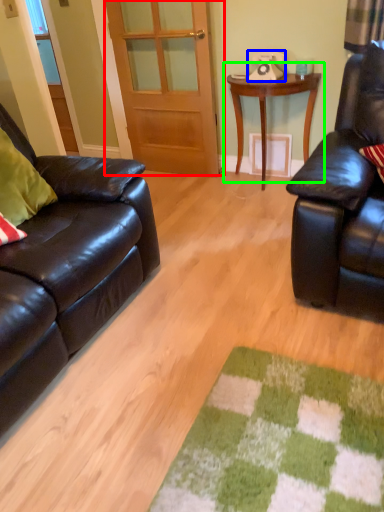
Question: Which object is positioned closest to door (highlighted by a red box)? Select from corded phone (highlighted by a blue box) and table (highlighted by a green box).

Choices:
 (A) corded phone
 (B) table

Answer: (B)